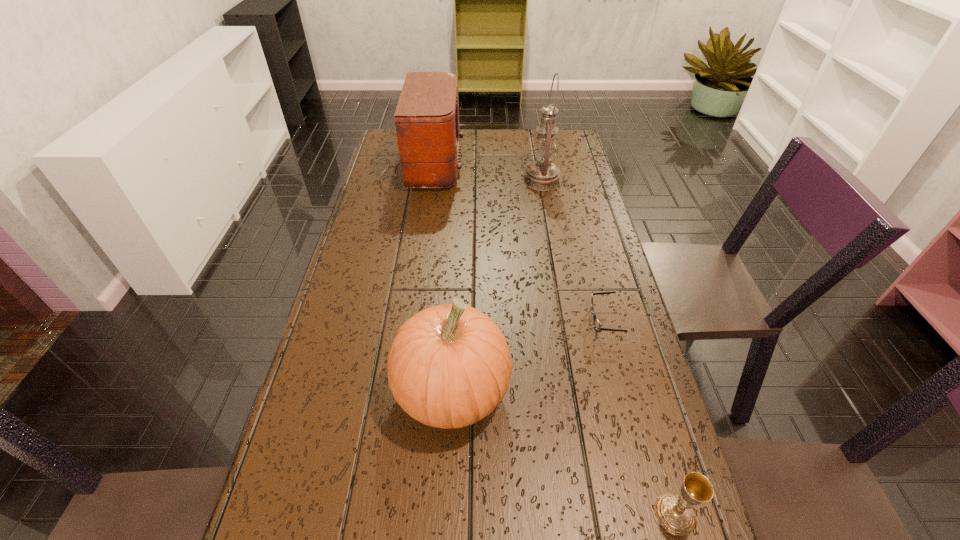
Locate which object ranks third in proximity to the tallest object. Please provide its 2D coordinates. Your answer should be formatted as a tuple, i.e. [(x, y)], where the tuple contains the x and y coordinates of a point satisfying the conditions above.

[(449, 366)]

Find the location of a particular element. Image resolution: width=960 pixels, height=540 pixels. vacant area in the image that satisfies the following two spatial constraints: 1. on the front-facing side of the spectacles; 2. on the left side of the chalice is located at coordinates (654, 514).

The width and height of the screenshot is (960, 540). I want to click on vacant region that satisfies the following two spatial constraints: 1. on the front panel of the radio receiver; 2. on the right side of the chalice, so click(x=359, y=514).

Where is `vacant region that satisfies the following two spatial constraints: 1. on the front panel of the tallest object; 2. on the right side of the radio receiver`? vacant region that satisfies the following two spatial constraints: 1. on the front panel of the tallest object; 2. on the right side of the radio receiver is located at coordinates (419, 180).

The image size is (960, 540). I want to click on vacant space that satisfies the following two spatial constraints: 1. on the front panel of the radio receiver; 2. on the left side of the chalice, so click(x=359, y=514).